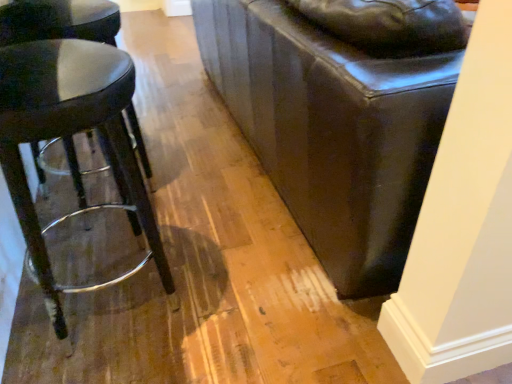
The width and height of the screenshot is (512, 384). I want to click on empty space that is to the right of matte black stool at left, marked as the first stool in a front-to-back arrangement, so click(231, 314).